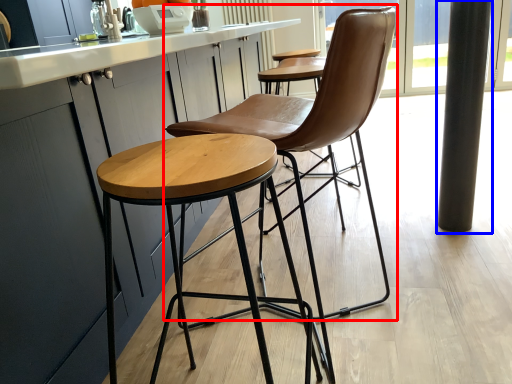
Question: Among these objects, which one is nearest to the camera, chair (highlighted by a red box) or pillar (highlighted by a blue box)?

Choices:
 (A) chair
 (B) pillar

Answer: (A)